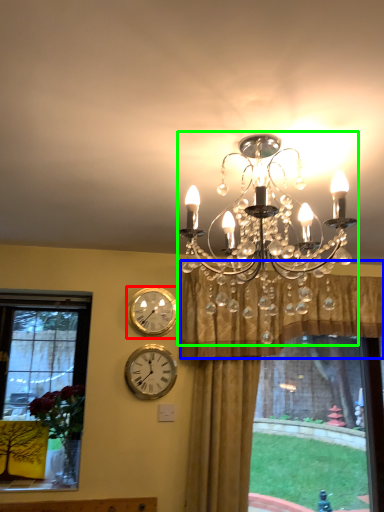
Question: Based on their relative distances, which object is farther from wall clock (highlighted by a red box)? Choose from curtain (highlighted by a blue box) and lamp (highlighted by a green box).

Choices:
 (A) curtain
 (B) lamp

Answer: (B)